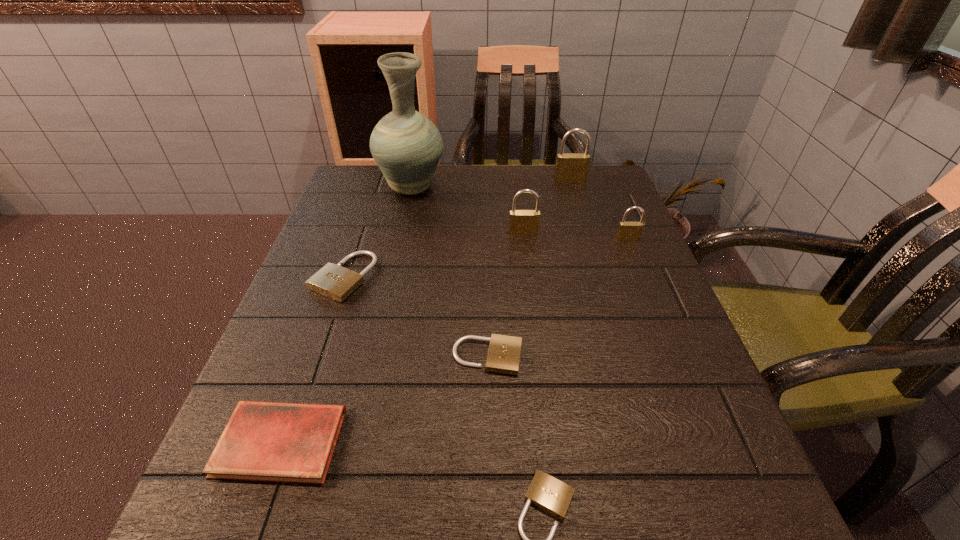
Identify which object is located as the second nearest to the rightmost object. Please provide its 2D coordinates. Your answer should be formatted as a tuple, i.e. [(x, y)], where the tuple contains the x and y coordinates of a point satisfying the conditions above.

[(570, 167)]

This screenshot has height=540, width=960. In order to click on object that is the second nearest to the farthest padlock in this screenshot , I will do `click(627, 231)`.

The height and width of the screenshot is (540, 960). What are the coordinates of `padlock that is the third nearest to the farthest beige padlock` in the screenshot? It's located at (546, 492).

You are a GUI agent. You are given a task and a screenshot of the screen. Output one action in this format:
    pyautogui.click(x=<x>, y=<y>)
    Task: Click on the padlock that stands as the third closest to the seventh shortest object
    The image size is (960, 540).
    Given the screenshot: What is the action you would take?
    pyautogui.click(x=336, y=282)

Find the location of a particular element. brass padlock that stands as the closest to the sixth nearest object is located at coordinates (627, 231).

At what (x,y) coordinates should I click in order to perform the action: click on brass padlock that can be found as the closest to the fifth nearest padlock. Please return your answer as a coordinate pair (x, y). The height and width of the screenshot is (540, 960). Looking at the image, I should click on (627, 231).

The image size is (960, 540). Find the location of `the closest beige padlock relative to the rightmost brass padlock`. the closest beige padlock relative to the rightmost brass padlock is located at coordinates (504, 351).

This screenshot has height=540, width=960. I want to click on beige padlock that is the second closest one to the smallest brass padlock, so click(x=336, y=282).